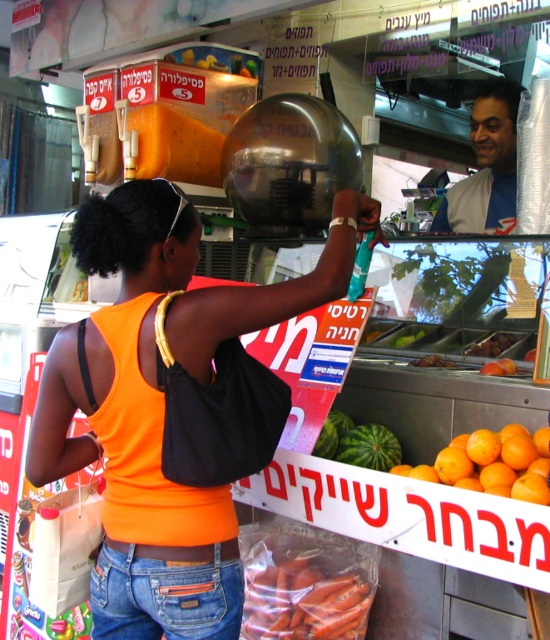
You are a tailor measuring the distance between the orange fabric tank top at center and the jeans at lower center for a custom outfit. Given that the minimum required space between garments for proper fitting is 5 inches, can the current distance accommodate this requirement?

The distance between the orange fabric tank top at center and the jeans at lower center is 6.29 inches, which exceeds the minimum required 5 inches. Therefore, the current distance can accommodate the requirement.

You are standing at the food stall and want to reach the display case with fresh fruits. The display case is located at point [462,211]. There is an obstacle at point [372,428]. Will you need to go around the obstacle to reach the display case?

Point [462,211] is behind point [372,428], so yes, you will need to go around the obstacle at point [372,428] to reach the display case at point [462,211].